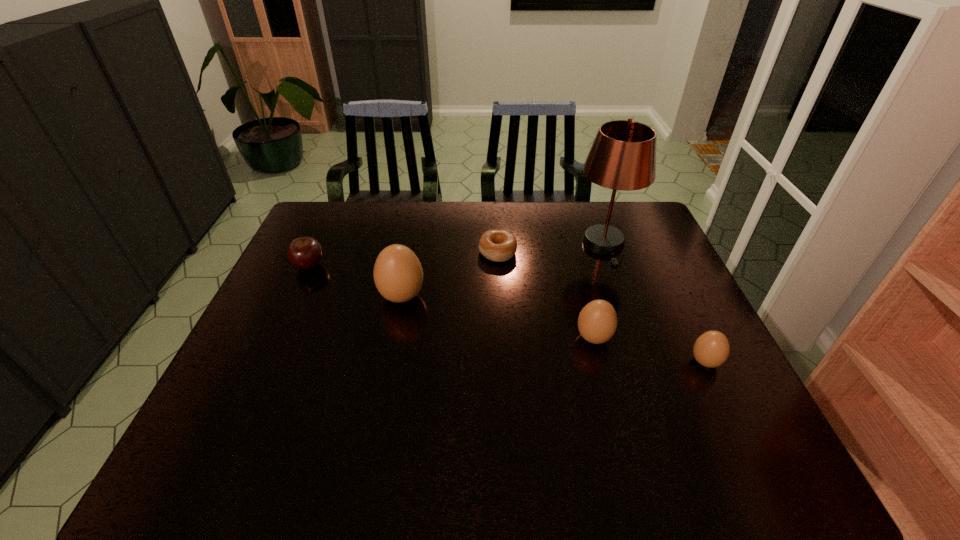
The height and width of the screenshot is (540, 960). In order to click on vacant area located on the back of the third nearest object in this screenshot , I will do `click(416, 225)`.

The height and width of the screenshot is (540, 960). Find the location of `free space located on the front of the third tallest object`. free space located on the front of the third tallest object is located at coordinates [604, 379].

You are a GUI agent. You are given a task and a screenshot of the screen. Output one action in this format:
    pyautogui.click(x=<x>, y=<y>)
    Task: Click on the free space located 0.100m on the back of the rightmost boiled egg
    The image size is (960, 540).
    Given the screenshot: What is the action you would take?
    pyautogui.click(x=685, y=321)

In order to click on free region located on the front-facing side of the lampshade in this screenshot , I will do `click(645, 360)`.

The width and height of the screenshot is (960, 540). Identify the location of vacant position located 0.340m on the right of the bagel. (623, 253).

Locate an element on the screen. free space located 0.130m on the right of the leftmost object is located at coordinates (368, 266).

Identify the location of lampshade located in the far edge section of the desktop. (623, 155).

At what (x,y) coordinates should I click in order to perform the action: click on bagel that is at the far edge. Please return your answer as a coordinate pair (x, y). The height and width of the screenshot is (540, 960). Looking at the image, I should click on (496, 245).

Image resolution: width=960 pixels, height=540 pixels. Identify the location of object that is positioned at the left edge. [305, 253].

Identify the location of boiled egg positioned at the right edge. The image size is (960, 540). (711, 349).